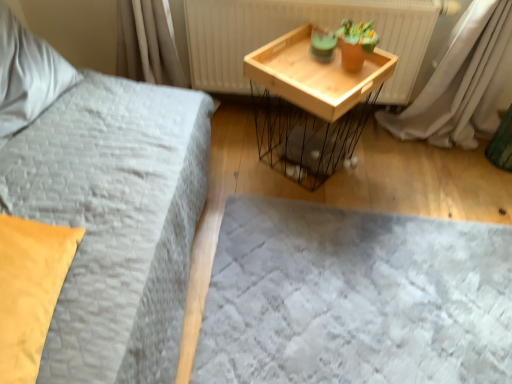
Describe the element at coordinates (30, 290) in the screenshot. The height and width of the screenshot is (384, 512). I see `matte yellow pillow at left, which is counted as the second pillow, starting from the left` at that location.

At what (x,y) coordinates should I click in order to perform the action: click on soft gray fabric bed frame at lower center. Please return your answer as a coordinate pair (x, y). Looking at the image, I should click on (355, 298).

The width and height of the screenshot is (512, 384). What do you see at coordinates (311, 105) in the screenshot? I see `wooden tray at center` at bounding box center [311, 105].

In order to click on wooden tray at upper right in this screenshot , I will do `click(298, 26)`.

Can you confirm if soft white pillow at upper left, the second pillow from the bottom, is bigger than wooden tray at center?

Actually, soft white pillow at upper left, the second pillow from the bottom, might be smaller than wooden tray at center.

Which is nearer, (15, 45) or (295, 100)?

Clearly, point (15, 45) is closer to the camera than point (295, 100).

I want to click on table behind the soft white pillow at upper left, the 2th pillow in the right-to-left sequence, so click(311, 105).

From a real-world perspective, relative to wooden tray at center, is soft white pillow at upper left, the first pillow when ordered from top to bottom, vertically above or below?

From a real-world perspective, soft white pillow at upper left, the first pillow when ordered from top to bottom, is physically above wooden tray at center.

This screenshot has width=512, height=384. I want to click on pillow that is the 2nd object located in front of the soft gray fabric bed frame at lower center, so click(x=30, y=290).

From a real-world perspective, is matte yellow pillow at left, positioned as the first pillow in front-to-back order, on top of soft gray fabric bed frame at lower center?

Yes, from a real-world perspective, matte yellow pillow at left, positioned as the first pillow in front-to-back order, is on top of soft gray fabric bed frame at lower center.

Is point (16, 271) more distant than point (284, 354)?

No, (16, 271) is closer to viewer.

How distant is matte yellow pillow at left, the 1th pillow viewed from the right, from soft gray fabric bed frame at lower center?

matte yellow pillow at left, the 1th pillow viewed from the right, is 31.52 inches from soft gray fabric bed frame at lower center.

I want to click on table lying above the soft gray fabric bed frame at lower center (from the image's perspective), so click(x=311, y=105).

From the image's perspective, does wooden tray at center appear lower than soft gray fabric bed frame at lower center?

No, from the image's perspective, wooden tray at center is not below soft gray fabric bed frame at lower center.

Consider the image. Is wooden tray at upper right facing towards soft white pillow at upper left, the 2th pillow in the right-to-left sequence?

No, wooden tray at upper right is not turned towards soft white pillow at upper left, the 2th pillow in the right-to-left sequence.

At what (x,y) coordinates should I click in order to perform the action: click on radiator on the right side of soft white pillow at upper left, the 1th pillow in the back-to-front sequence. Please return your answer as a coordinate pair (x, y). The width and height of the screenshot is (512, 384). Looking at the image, I should click on (298, 26).

Considering the sizes of wooden tray at upper right and soft white pillow at upper left, the 2th pillow in the right-to-left sequence, in the image, is wooden tray at upper right wider or thinner than soft white pillow at upper left, the 2th pillow in the right-to-left sequence,?

Considering their sizes, wooden tray at upper right looks slimmer than soft white pillow at upper left, the 2th pillow in the right-to-left sequence.

Is wooden tray at upper right inside or outside of soft white pillow at upper left, the second pillow from the bottom?

wooden tray at upper right is not inside soft white pillow at upper left, the second pillow from the bottom, it's outside.

In the scene shown: From the image's perspective, is soft white pillow at upper left, the first pillow when ordered from top to bottom, beneath soft gray fabric bed frame at lower center?

No.

Between soft white pillow at upper left, the second pillow from the bottom, and soft gray fabric bed frame at lower center, which one has less height?

soft gray fabric bed frame at lower center.

Which of these two, soft white pillow at upper left, the 1th pillow from the left, or soft gray fabric bed frame at lower center, is wider?

soft gray fabric bed frame at lower center is wider.

Between point (493, 359) and point (187, 32), which one is positioned behind?

The point (187, 32) is more distant.

From a real-world perspective, which object rests below the other?

In real-world perspective, soft gray fabric bed frame at lower center is lower.

From the image's perspective, which is below, soft gray fabric bed frame at lower center or wooden tray at upper right?

soft gray fabric bed frame at lower center is shown below in the image.

From a real-world perspective, between wooden tray at center and matte yellow pillow at left, which is the second pillow in back-to-front order, who is vertically higher?

matte yellow pillow at left, which is the second pillow in back-to-front order.

Considering the relative sizes of wooden tray at center and matte yellow pillow at left, which is the second pillow in back-to-front order, in the image provided, is wooden tray at center wider than matte yellow pillow at left, which is the second pillow in back-to-front order,?

Indeed, wooden tray at center has a greater width compared to matte yellow pillow at left, which is the second pillow in back-to-front order.

Does wooden tray at center turn towards matte yellow pillow at left, placed as the 2th pillow when sorted from top to bottom?

No, wooden tray at center is not facing towards matte yellow pillow at left, placed as the 2th pillow when sorted from top to bottom.

Where is `pillow located above the wooden tray at center (from the image's perspective)`? This screenshot has height=384, width=512. pillow located above the wooden tray at center (from the image's perspective) is located at coordinates pos(27,75).

In order to click on bed frame below the matte yellow pillow at left, which is counted as the first pillow, starting from the bottom (from a real-world perspective) in this screenshot , I will do `click(355, 298)`.

From the picture: When comparing their distances from soft gray fabric bed frame at lower center, does wooden tray at upper right or matte yellow pillow at left, which is counted as the second pillow, starting from the left, seem closer?

matte yellow pillow at left, which is counted as the second pillow, starting from the left.

Estimate the real-world distances between objects in this image. Which object is further from soft white pillow at upper left, the second pillow from the front, wooden tray at center or soft gray fabric bed frame at lower center?

The object further to soft white pillow at upper left, the second pillow from the front, is soft gray fabric bed frame at lower center.

When comparing their distances from soft white pillow at upper left, the 1th pillow from the left, does wooden tray at upper right or wooden tray at center seem closer?

wooden tray at upper right.

Looking at the image, which one is located further to soft white pillow at upper left, the first pillow when ordered from top to bottom, soft gray fabric bed frame at lower center or matte yellow pillow at left, placed as the 2th pillow when sorted from top to bottom?

The object further to soft white pillow at upper left, the first pillow when ordered from top to bottom, is soft gray fabric bed frame at lower center.

Based on the photo, which object lies nearer to the anchor point wooden tray at upper right, matte yellow pillow at left, the 1th pillow viewed from the right, or soft white pillow at upper left, the second pillow from the bottom?

Among the two, soft white pillow at upper left, the second pillow from the bottom, is located nearer to wooden tray at upper right.

Considering their positions, is matte yellow pillow at left, which is counted as the first pillow, starting from the bottom, positioned further to wooden tray at center than soft white pillow at upper left, the 1th pillow in the back-to-front sequence?

matte yellow pillow at left, which is counted as the first pillow, starting from the bottom.

From the image, which object appears to be farther from wooden tray at upper right, matte yellow pillow at left, which is counted as the second pillow, starting from the left, or soft gray fabric bed frame at lower center?

matte yellow pillow at left, which is counted as the second pillow, starting from the left.

Considering their positions, is soft gray fabric bed frame at lower center positioned closer to wooden tray at center than matte yellow pillow at left, which is counted as the first pillow, starting from the bottom?

Among the two, soft gray fabric bed frame at lower center is located nearer to wooden tray at center.

Find the location of a particular element. This screenshot has height=384, width=512. pillow between soft white pillow at upper left, the second pillow from the bottom, and wooden tray at center is located at coordinates (30, 290).

This screenshot has height=384, width=512. I want to click on pillow located between soft white pillow at upper left, the second pillow from the bottom, and soft gray fabric bed frame at lower center in the left-right direction, so click(30, 290).

The width and height of the screenshot is (512, 384). I want to click on table situated between soft white pillow at upper left, the first pillow when ordered from top to bottom, and soft gray fabric bed frame at lower center from left to right, so click(311, 105).

You are a GUI agent. You are given a task and a screenshot of the screen. Output one action in this format:
    pyautogui.click(x=<x>, y=<y>)
    Task: Click on the radiator between soft white pillow at upper left, the 1th pillow in the back-to-front sequence, and soft gray fabric bed frame at lower center
    Image resolution: width=512 pixels, height=384 pixels.
    Given the screenshot: What is the action you would take?
    pyautogui.click(x=298, y=26)